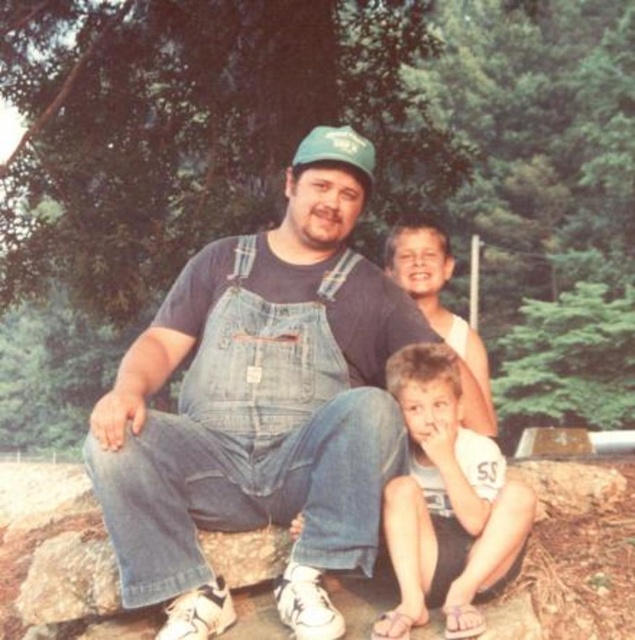
Question: Which point is closer to the camera taking this photo?

Choices:
 (A) (378, 428)
 (B) (439, 433)

Answer: (A)

Question: Does denim overalls at center have a smaller size compared to light brown hair at lower center?

Choices:
 (A) yes
 (B) no

Answer: (B)

Question: Which point appears farthest from the camera in this image?

Choices:
 (A) (432, 307)
 (B) (526, 490)

Answer: (A)

Question: Does denim overalls at center appear on the left side of light brown hair at lower center?

Choices:
 (A) no
 (B) yes

Answer: (B)

Question: Does denim overalls at center have a smaller size compared to light brown hair at lower center?

Choices:
 (A) yes
 (B) no

Answer: (B)

Question: Which of the following is the closest to the observer?

Choices:
 (A) denim overalls at center
 (B) light brown hair at lower center
 (C) smooth tan skin at upper center

Answer: (B)